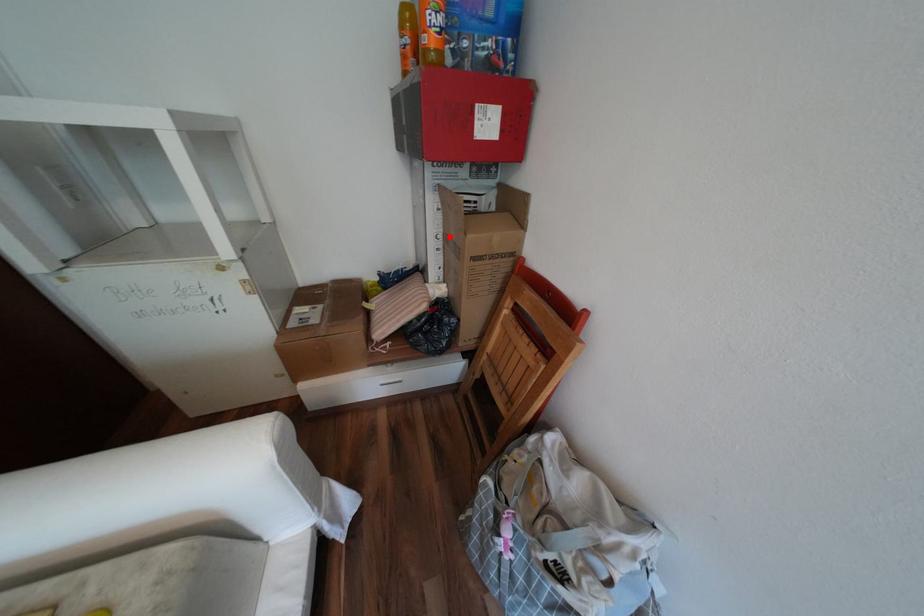
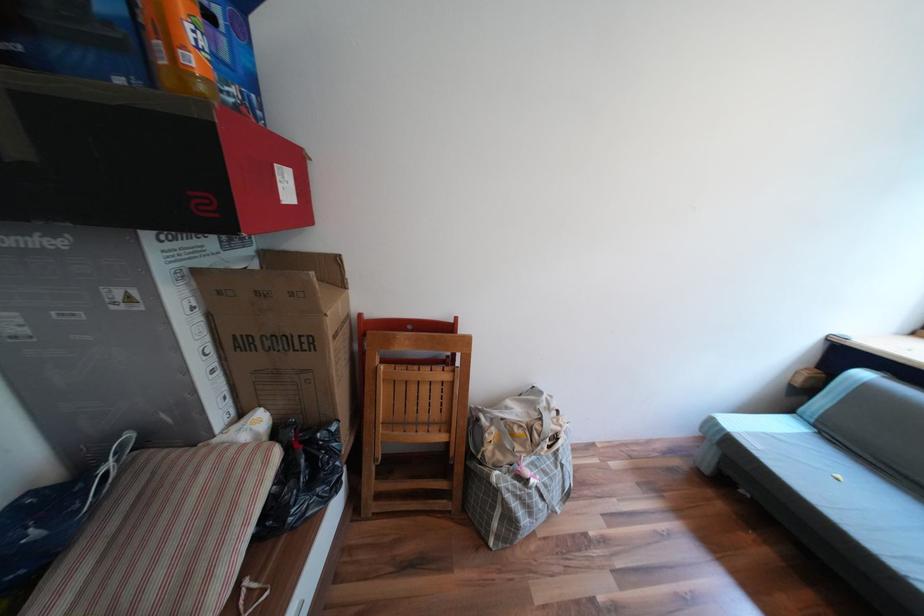
Where in the second image is the point corresponding to the highlighted location from the first image?

(219, 349)